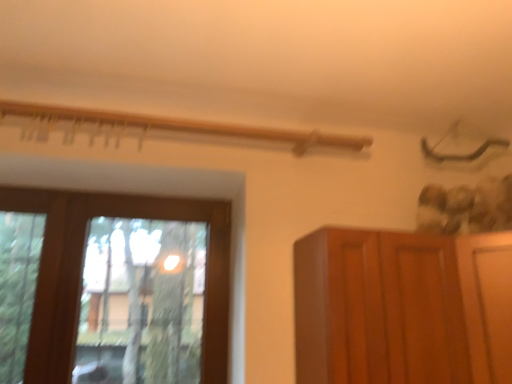
Question: Is brown wooden cupboard at right surrounding transparent glass window at left?

Choices:
 (A) no
 (B) yes

Answer: (A)

Question: Is brown wooden cupboard at right not near transparent glass window at left?

Choices:
 (A) no
 (B) yes

Answer: (A)

Question: From a real-world perspective, is brown wooden cupboard at right under transparent glass window at left?

Choices:
 (A) no
 (B) yes

Answer: (B)

Question: From a real-world perspective, is brown wooden cupboard at right on transparent glass window at left?

Choices:
 (A) no
 (B) yes

Answer: (A)

Question: From the image's perspective, would you say brown wooden cupboard at right is positioned over transparent glass window at left?

Choices:
 (A) yes
 (B) no

Answer: (B)

Question: Does brown wooden cupboard at right appear on the right side of transparent glass window at left?

Choices:
 (A) yes
 (B) no

Answer: (A)

Question: Is transparent glass window at left to the right of brown wooden cupboard at right from the viewer's perspective?

Choices:
 (A) yes
 (B) no

Answer: (B)

Question: Does transparent glass window at left have a lesser height compared to brown wooden cupboard at right?

Choices:
 (A) no
 (B) yes

Answer: (A)

Question: Is transparent glass window at left positioned behind brown wooden cupboard at right?

Choices:
 (A) no
 (B) yes

Answer: (B)

Question: From a real-world perspective, is transparent glass window at left on brown wooden cupboard at right?

Choices:
 (A) yes
 (B) no

Answer: (A)

Question: Is transparent glass window at left turned away from brown wooden cupboard at right?

Choices:
 (A) yes
 (B) no

Answer: (B)

Question: Considering the relative sizes of transparent glass window at left and brown wooden cupboard at right in the image provided, is transparent glass window at left thinner than brown wooden cupboard at right?

Choices:
 (A) no
 (B) yes

Answer: (B)

Question: In the image, is brown wooden cupboard at right positioned in front of or behind transparent glass window at left?

Choices:
 (A) behind
 (B) front

Answer: (B)